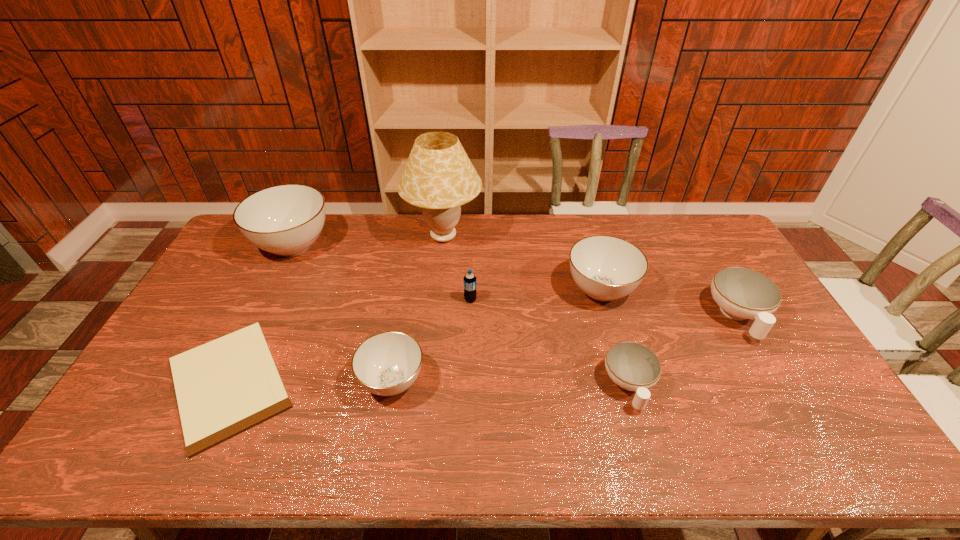
This screenshot has width=960, height=540. Find the location of `the tallest object`. the tallest object is located at coordinates click(439, 177).

This screenshot has width=960, height=540. I want to click on yellow lampshade, so tap(439, 177).

Where is `the leftmost gray chinaware`? The width and height of the screenshot is (960, 540). the leftmost gray chinaware is located at coordinates (286, 220).

Where is `the tallest chinaware`? the tallest chinaware is located at coordinates (286, 220).

I want to click on the rightmost gray chinaware, so click(x=606, y=268).

The width and height of the screenshot is (960, 540). Find the location of `the second tallest chinaware`. the second tallest chinaware is located at coordinates (606, 268).

This screenshot has height=540, width=960. I want to click on soda bottle, so click(469, 280).

You are a GUI agent. You are given a task and a screenshot of the screen. Output one action in this format:
    pyautogui.click(x=<x>, y=<y>)
    Task: Click on the farther white chinaware
    
    Given the screenshot: What is the action you would take?
    pyautogui.click(x=742, y=293)

Locate an element on the screen. the rightmost object is located at coordinates (742, 293).

Locate an element on the screen. This screenshot has width=960, height=540. the second gray chinaware from right to left is located at coordinates (386, 364).